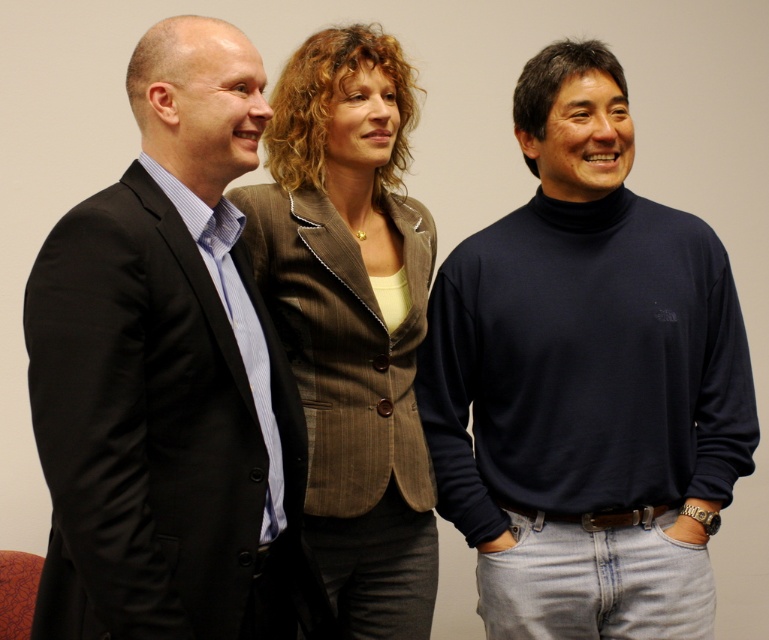
Consider the image. You are standing at the point marked by the coordinates point (641, 220). You want to walk towards the person in the center wearing a brown blazer with white trim. How far will you have to walk to reach them?

The distance between you and the person in the center is 5.74 feet, so you will have to walk 5.74 feet to reach them.

Based on the photo, you are standing in front of a group of three people having a casual conversation. There is a specific point at coordinates point [28,388] that you need to reach. Considering the people are positioned between you and this point, can you estimate if you can comfortably walk to the point without needing to move around them?

The point [28,388] is 3.98 feet away from you, so yes, you can comfortably walk to it without needing to move around the people since it is within a reachable distance.